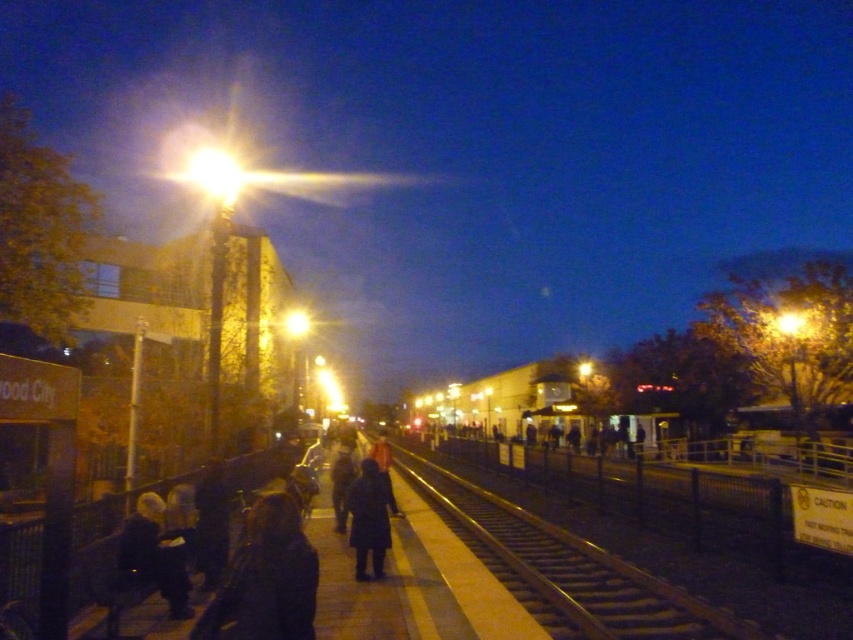
You are a delivery robot with a package that needs to be delivered to the dark matte coat at center. You are currently positioned at the dark blue coat at lower left. The robot has a maximum delivery range of 2 meters. Can you reach the destination without exceeding your range?

The distance between the dark blue coat at lower left and the dark matte coat at center is 2.41 meters, which exceeds the robot s 2 meter range. Therefore, the robot cannot reach the destination without exceeding its maximum delivery range.

You are standing on the platform waiting for your train. You see a metallic smooth train track at center and a dark blue coat at lower left. Which object is positioned closer to the right side of the platform?

The metallic smooth train track at center is positioned to the right of the dark blue coat at lower left, so it is closer to the right side of the platform.

You are standing on the platform at the train station. You need to locate the metallic smooth train track at center. Where exactly is it positioned in terms of coordinates?

The metallic smooth train track at center is located at coordinates point (566, 570).